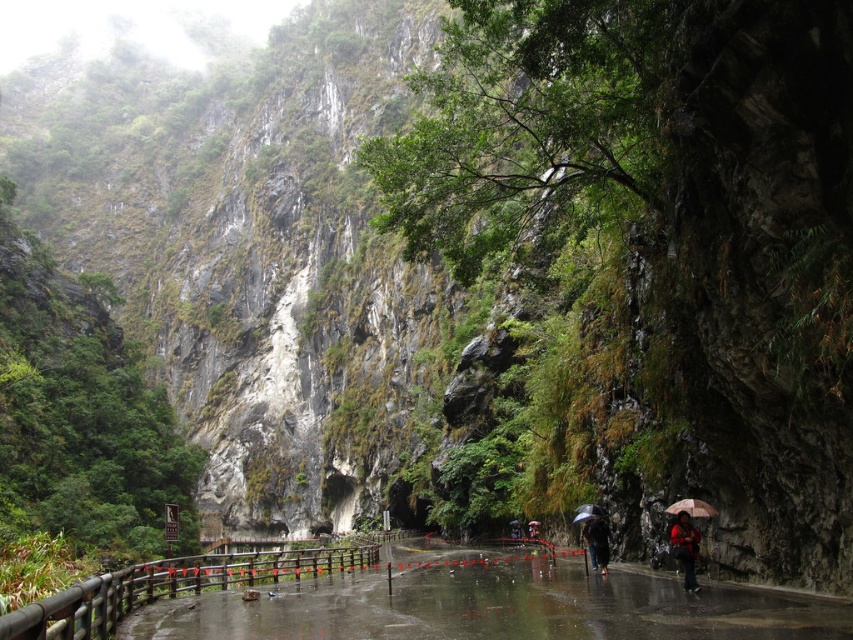
You are a hiker standing on the pathway and see the red matte jacket at lower right and the dark brown umbrella at center. Which object is closer to you?

The red matte jacket at lower right is closer to you because it is positioned over the dark brown umbrella at center.

You are standing at the starting point of the mountain trail and see the dark brown umbrella at center ahead. If you want to reach it quickly, should you walk straight towards it or take a detour? Explain your reasoning based on the distance provided.

The dark brown umbrella at center is 40.38 meters away from you. Since the path is paved and the distance is straightforward, walking straight towards it is the quickest route without needing a detour.

Consider the image. You are a hiker who wants to take a photo of the dark brown umbrella at center without the red matte jacket at lower right appearing in the frame. Since you can only move forward or backward along the path, which direction should you move?

The red matte jacket at lower right is closer to the viewer than the dark brown umbrella at center. To avoid the jacket in the photo, move forward along the path to increase the distance between you and the jacket while getting closer to the umbrella.